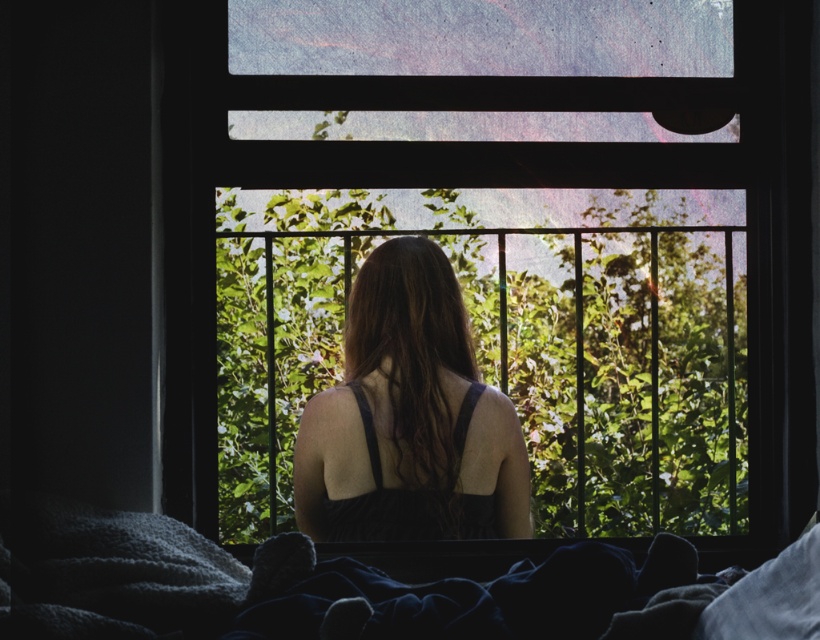
Does transparent glass window at center appear on the right side of soft woolen blanket at lower left?

Correct, you'll find transparent glass window at center to the right of soft woolen blanket at lower left.

Who is higher up, transparent glass window at center or soft woolen blanket at lower left?

Positioned higher is transparent glass window at center.

Who is more distant from viewer, (772, 92) or (292, 573)?

Point (772, 92)

Identify the location of transparent glass window at center. (499, 241).

Between soft woolen blanket at lower left and matte black dress at center, which one has more height?

Standing taller between the two is matte black dress at center.

Between soft woolen blanket at lower left and matte black dress at center, which one appears on the right side from the viewer's perspective?

matte black dress at center is more to the right.

This screenshot has width=820, height=640. I want to click on soft woolen blanket at lower left, so click(479, 596).

Is the position of transparent glass window at center less distant than that of matte black dress at center?

Yes, transparent glass window at center is in front of matte black dress at center.

Who is more forward, [563,365] or [345,394]?

Point [345,394]

In order to click on transparent glass window at center in this screenshot , I will do `click(499, 241)`.